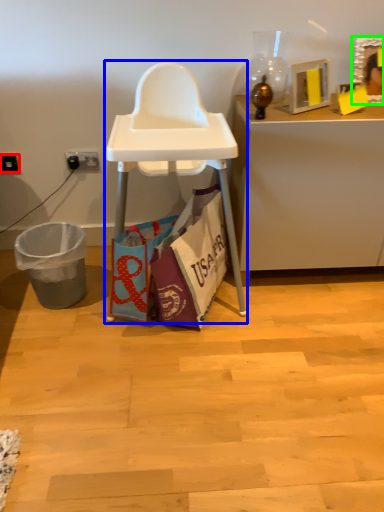
Question: Which is nearer to the power outlet (highlighted by a red box)? armchair (highlighted by a blue box) or picture frame (highlighted by a green box).

Choices:
 (A) armchair
 (B) picture frame

Answer: (A)